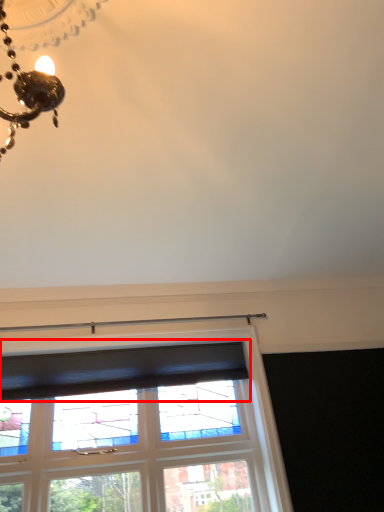
Question: From the image's perspective, where is curtain (annotated by the red box) located in relation to window in the image?

Choices:
 (A) below
 (B) above

Answer: (B)